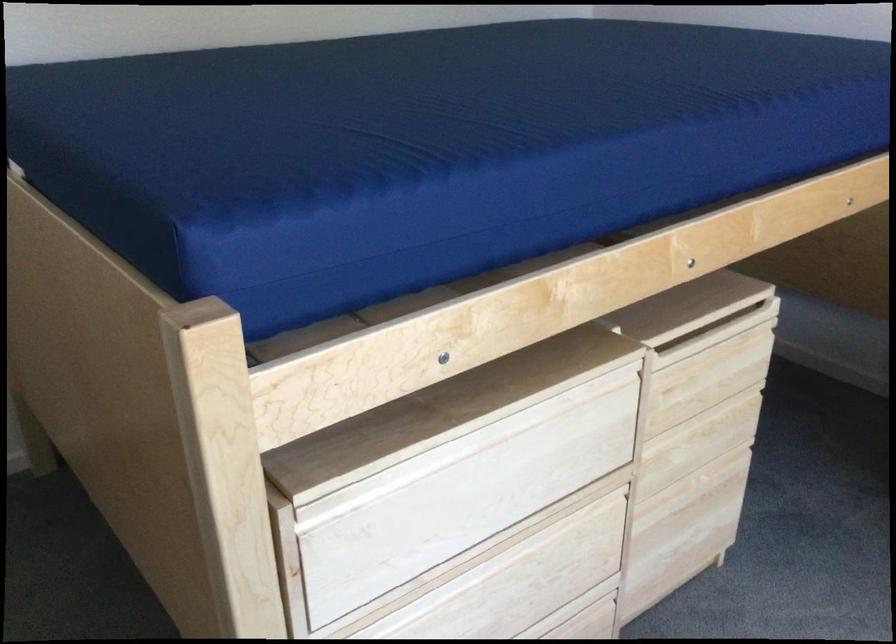
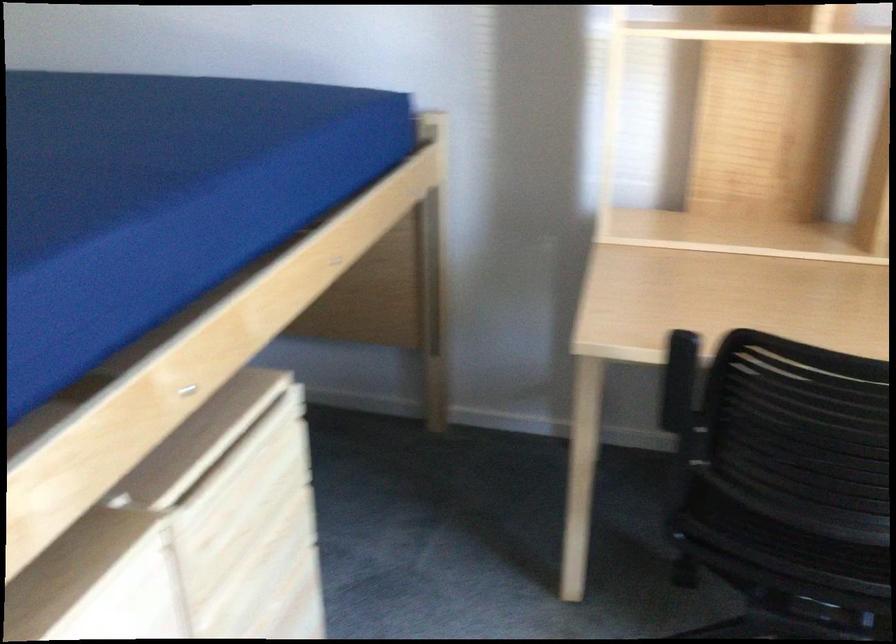
The point at (685,310) is marked in the first image. Where is the corresponding point in the second image?

(202, 439)